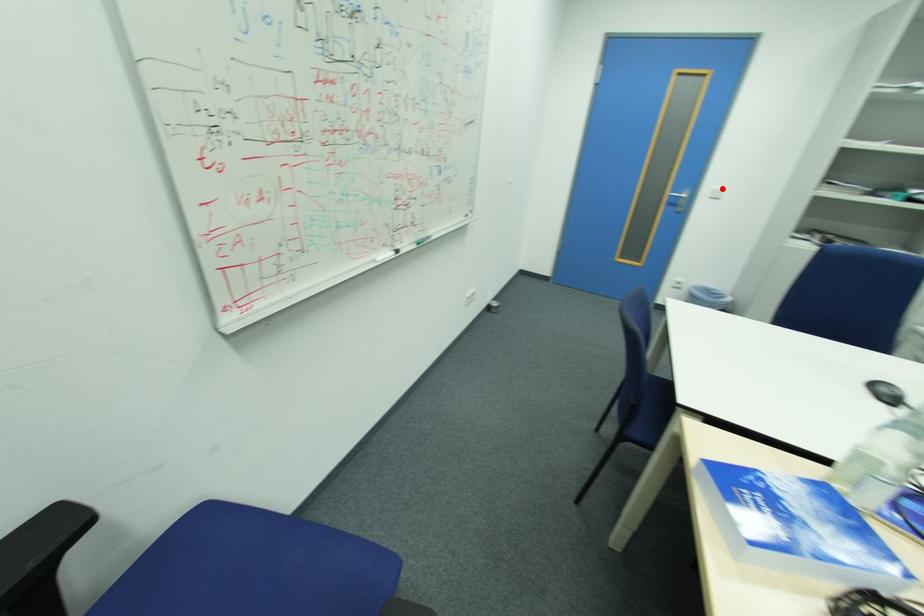
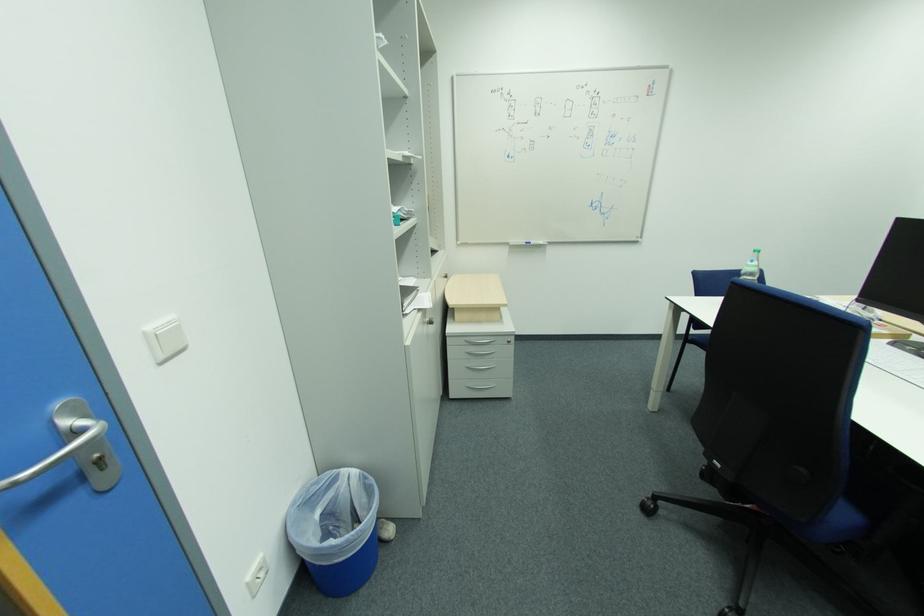
The point at the highlighted location is marked in the first image. Where is the corresponding point in the second image?

(154, 329)